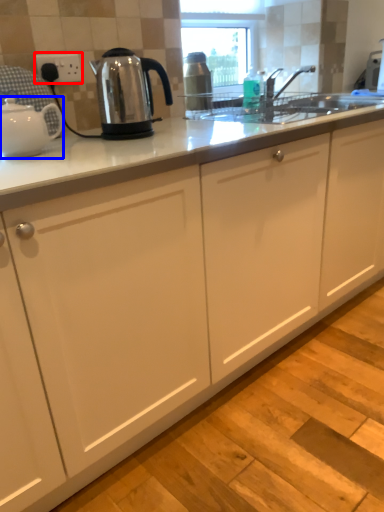
Question: Which point is further to the camera, electric outlet (highlighted by a red box) or kettle (highlighted by a blue box)?

Choices:
 (A) electric outlet
 (B) kettle

Answer: (A)